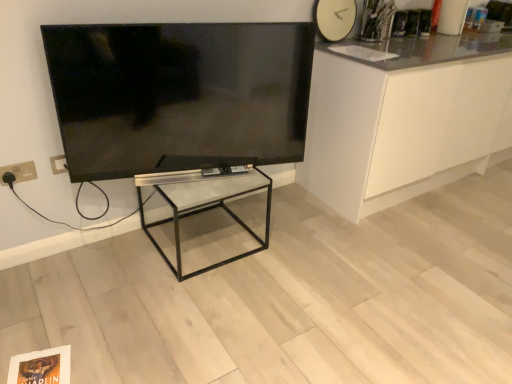
What is the approximate height of white glossy cabinet at right?

36.02 inches.

The width and height of the screenshot is (512, 384). What do you see at coordinates (334, 18) in the screenshot? I see `white matte clock at upper right` at bounding box center [334, 18].

This screenshot has width=512, height=384. I want to click on clear glass table at center, so click(x=204, y=205).

This screenshot has height=384, width=512. Describe the element at coordinates (179, 95) in the screenshot. I see `flat screen tv at upper left` at that location.

Identify the location of white glossy cabinet at right. The height and width of the screenshot is (384, 512). (405, 119).

In the scene shown: From a real-world perspective, is white matte clock at upper right physically above gold metallic electric outlet at lower left?

Yes, from a real-world perspective, white matte clock at upper right is on top of gold metallic electric outlet at lower left.

From the image's perspective, between white matte clock at upper right and gold metallic electric outlet at lower left, which one is located above?

From the image's view, white matte clock at upper right is above.

Considering the sizes of objects white matte clock at upper right and gold metallic electric outlet at lower left in the image provided, who is wider, white matte clock at upper right or gold metallic electric outlet at lower left?

white matte clock at upper right.

Is white matte clock at upper right looking in the opposite direction of gold metallic electric outlet at lower left?

No, white matte clock at upper right's orientation is not away from gold metallic electric outlet at lower left.

Does clear glass table at center have a larger size compared to flat screen tv at upper left?

Indeed, clear glass table at center has a larger size compared to flat screen tv at upper left.

In the scene shown: From a real-world perspective, who is located higher, clear glass table at center or flat screen tv at upper left?

flat screen tv at upper left, from a real-world perspective.

Is clear glass table at center wider or thinner than flat screen tv at upper left?

Considering their sizes, clear glass table at center looks broader than flat screen tv at upper left.

Would you consider clear glass table at center to be distant from flat screen tv at upper left?

No, clear glass table at center is not far away from flat screen tv at upper left.

Does flat screen tv at upper left lie in front of gold metallic electric outlet at lower left?

Yes, it is in front of gold metallic electric outlet at lower left.

Is flat screen tv at upper left to the left or to the right of gold metallic electric outlet at lower left in the image?

From the image, it's evident that flat screen tv at upper left is to the right of gold metallic electric outlet at lower left.

Can gold metallic electric outlet at lower left be found inside flat screen tv at upper left?

That's incorrect, gold metallic electric outlet at lower left is not inside flat screen tv at upper left.

Based on their sizes in the image, would you say flat screen tv at upper left is bigger or smaller than gold metallic electric outlet at lower left?

flat screen tv at upper left is bigger than gold metallic electric outlet at lower left.

How far apart are gold metallic electric outlet at lower left and clear glass table at center?

30.02 inches.

Is gold metallic electric outlet at lower left positioned with its back to clear glass table at center?

No, gold metallic electric outlet at lower left is not facing the opposite direction of clear glass table at center.

From the image's perspective, is gold metallic electric outlet at lower left positioned above or below clear glass table at center?

From the image's perspective, gold metallic electric outlet at lower left appears above clear glass table at center.

Looking at this image, is white glossy cabinet at right located outside clear glass table at center?

Yes.

From a real-world perspective, is white glossy cabinet at right physically located above or below clear glass table at center?

Clearly, from a real-world perspective, white glossy cabinet at right is above clear glass table at center.

Locate an element on the screen. Image resolution: width=512 pixels, height=384 pixels. cabinetry above the clear glass table at center (from the image's perspective) is located at coordinates (405, 119).

From the image's perspective, is white glossy cabinet at right above or below clear glass table at center?

Based on their image positions, white glossy cabinet at right is located above clear glass table at center.

Is white matte clock at upper right taller than flat screen tv at upper left?

Incorrect, the height of white matte clock at upper right is not larger of that of flat screen tv at upper left.

Considering the positions of objects white matte clock at upper right and flat screen tv at upper left in the image provided, who is more to the right, white matte clock at upper right or flat screen tv at upper left?

white matte clock at upper right.

Is white matte clock at upper right beside flat screen tv at upper left?

They are not placed beside each other.

Does flat screen tv at upper left have a larger size compared to white glossy cabinet at right?

No.

Considering the relative positions of flat screen tv at upper left and white glossy cabinet at right in the image provided, is flat screen tv at upper left to the right of white glossy cabinet at right from the viewer's perspective?

No.

Considering the relative sizes of flat screen tv at upper left and white glossy cabinet at right in the image provided, is flat screen tv at upper left wider than white glossy cabinet at right?

Incorrect, the width of flat screen tv at upper left does not surpass that of white glossy cabinet at right.

What are the coordinates of `cabinetry below the flat screen tv at upper left (from a real-world perspective)` in the screenshot? It's located at (405, 119).

This screenshot has width=512, height=384. Identify the location of electric outlet lying below the white matte clock at upper right (from the image's perspective). (19, 172).

Locate an element on the screen. This screenshot has height=384, width=512. television that is on the left side of clear glass table at center is located at coordinates (179, 95).

In the scene shown: Which object lies nearer to the anchor point gold metallic electric outlet at lower left, clear glass table at center or white glossy cabinet at right?

Based on the image, clear glass table at center appears to be nearer to gold metallic electric outlet at lower left.

When comparing their distances from clear glass table at center, does gold metallic electric outlet at lower left or flat screen tv at upper left seem further?

gold metallic electric outlet at lower left is positioned further to the anchor clear glass table at center.

In the scene shown: Based on their spatial positions, is flat screen tv at upper left or clear glass table at center further from white matte clock at upper right?

clear glass table at center is further to white matte clock at upper right.

Based on their spatial positions, is white matte clock at upper right or white glossy cabinet at right further from clear glass table at center?

white matte clock at upper right.

Which object lies further to the anchor point white glossy cabinet at right, gold metallic electric outlet at lower left or flat screen tv at upper left?

gold metallic electric outlet at lower left is positioned further to the anchor white glossy cabinet at right.

Estimate the real-world distances between objects in this image. Which object is further from white glossy cabinet at right, flat screen tv at upper left or clear glass table at center?

The object further to white glossy cabinet at right is clear glass table at center.

When comparing their distances from gold metallic electric outlet at lower left, does white glossy cabinet at right or clear glass table at center seem closer?

Based on the image, clear glass table at center appears to be nearer to gold metallic electric outlet at lower left.

Based on their spatial positions, is white matte clock at upper right or clear glass table at center closer to white glossy cabinet at right?

white matte clock at upper right is positioned closer to the anchor white glossy cabinet at right.

You are a GUI agent. You are given a task and a screenshot of the screen. Output one action in this format:
    pyautogui.click(x=<x>, y=<y>)
    Task: Click on the clock between clear glass table at center and white glossy cabinet at right in the horizontal direction
    The image size is (512, 384).
    Given the screenshot: What is the action you would take?
    pyautogui.click(x=334, y=18)

Find the location of a particular element. This screenshot has height=384, width=512. television situated between gold metallic electric outlet at lower left and white matte clock at upper right from left to right is located at coordinates (179, 95).

Locate an element on the screen. This screenshot has height=384, width=512. table between flat screen tv at upper left and white glossy cabinet at right in the horizontal direction is located at coordinates (204, 205).

This screenshot has height=384, width=512. What are the coordinates of `table between gold metallic electric outlet at lower left and white glossy cabinet at right in the horizontal direction` in the screenshot? It's located at (204, 205).